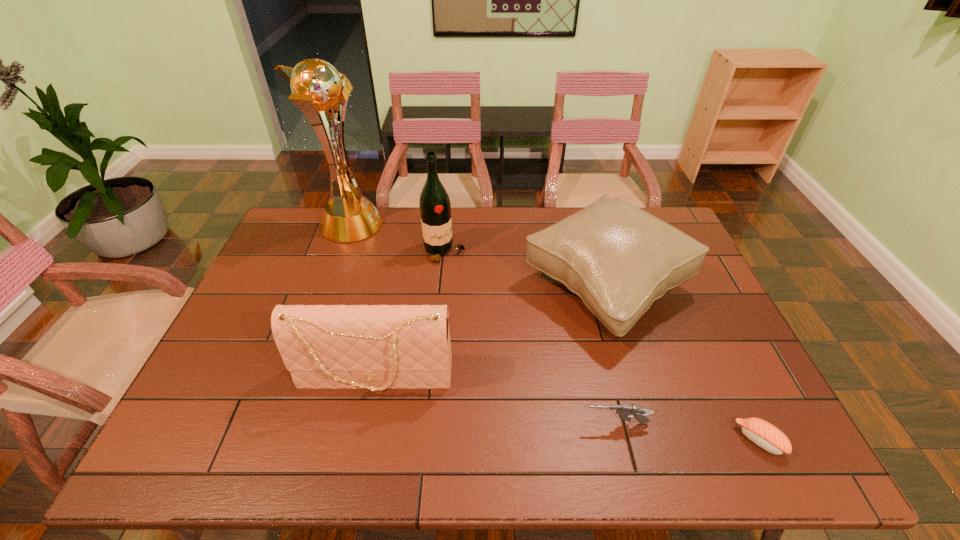
Identify which object is the fifth closest to the fifth shortest object. Please provide its 2D coordinates. Your answer should be formatted as a tuple, i.e. [(x, y)], where the tuple contains the x and y coordinates of a point satisfying the conditions above.

[(765, 435)]

Identify the location of free location that satisfies the following two spatial constraints: 1. on the front-facing side of the cushion; 2. on the left side of the tallest object. (327, 286).

I want to click on blank area in the image that satisfies the following two spatial constraints: 1. on the front-facing side of the tallest object; 2. on the right side of the cushion, so click(327, 286).

Image resolution: width=960 pixels, height=540 pixels. Find the location of `vacant region that satisfies the following two spatial constraints: 1. on the front side of the cushion; 2. at the barrel of the gun`. vacant region that satisfies the following two spatial constraints: 1. on the front side of the cushion; 2. at the barrel of the gun is located at coordinates (648, 423).

Find the location of a particular element. The image size is (960, 540). vacant area that satisfies the following two spatial constraints: 1. on the front side of the shortest object; 2. on the left side of the cushion is located at coordinates (653, 441).

Find the location of a particular element. The height and width of the screenshot is (540, 960). vacant space that satisfies the following two spatial constraints: 1. on the front-facing side of the tallest object; 2. on the back side of the cushion is located at coordinates (327, 286).

Locate an element on the screen. free space that satisfies the following two spatial constraints: 1. on the front-facing side of the fifth shortest object; 2. on the right side of the trophy is located at coordinates (340, 252).

At what (x,y) coordinates should I click in order to perform the action: click on free location that satisfies the following two spatial constraints: 1. on the front-facing side of the cushion; 2. on the left side of the tallest object. Please return your answer as a coordinate pair (x, y). This screenshot has width=960, height=540. Looking at the image, I should click on (327, 286).